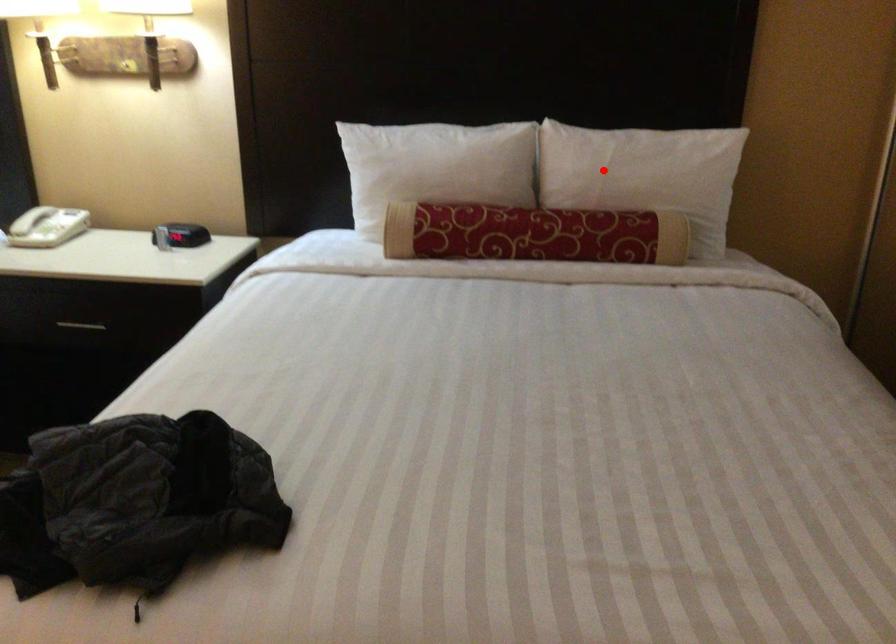
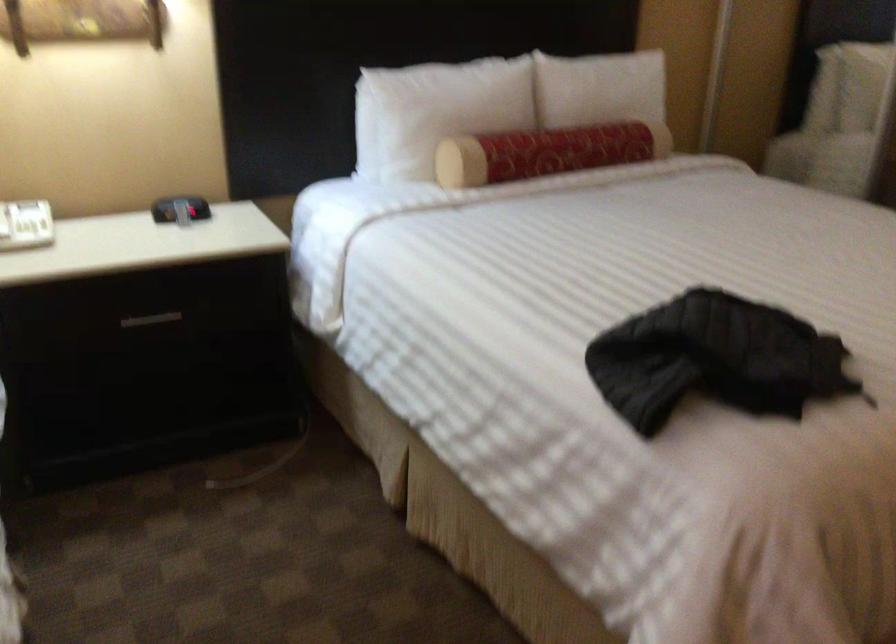
Question: A red point is marked in image1. In image2, is the corresponding 3D point closer to the camera or farther? Reply with the corresponding letter.

Choices:
 (A) The corresponding 3D point is closer.
 (B) The corresponding 3D point is farther.

Answer: (B)